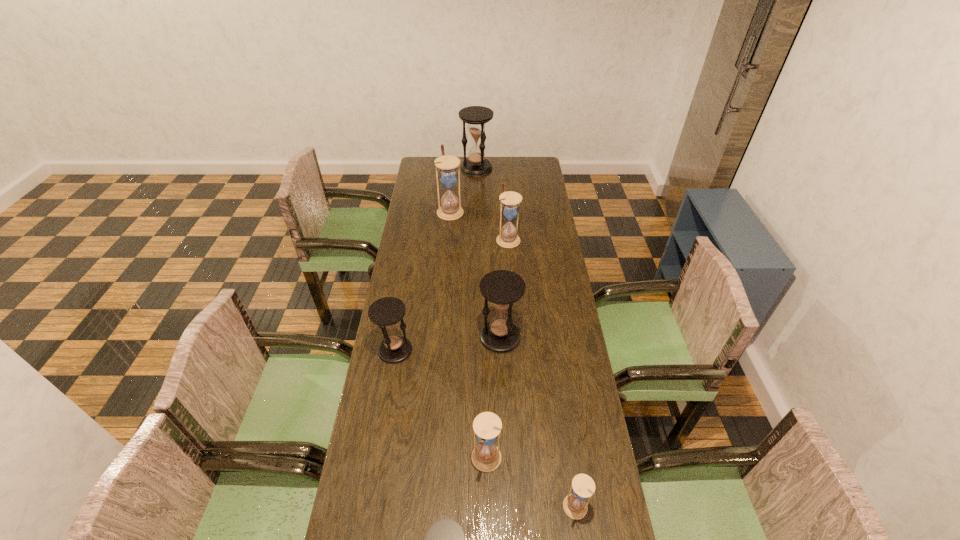
Where is `the farthest object`? The width and height of the screenshot is (960, 540). the farthest object is located at coordinates (476, 116).

Find the location of a particular element. Image resolution: width=960 pixels, height=540 pixels. the biggest black hourglass is located at coordinates (476, 116).

Find the location of `the biggest white hourglass`. the biggest white hourglass is located at coordinates (450, 209).

Locate an element on the screen. the leftmost white hourglass is located at coordinates (450, 209).

The width and height of the screenshot is (960, 540). I want to click on the third farthest object, so click(x=508, y=238).

This screenshot has height=540, width=960. Identify the location of the second farthest white hourglass. (508, 238).

Find the location of `the second biggest black hourglass`. the second biggest black hourglass is located at coordinates (502, 288).

Where is `the second smallest black hourglass`? The width and height of the screenshot is (960, 540). the second smallest black hourglass is located at coordinates (386, 312).

Locate an element on the screen. the leftmost black hourglass is located at coordinates [386, 312].

Where is `the third nearest hourglass`? Image resolution: width=960 pixels, height=540 pixels. the third nearest hourglass is located at coordinates (486, 456).